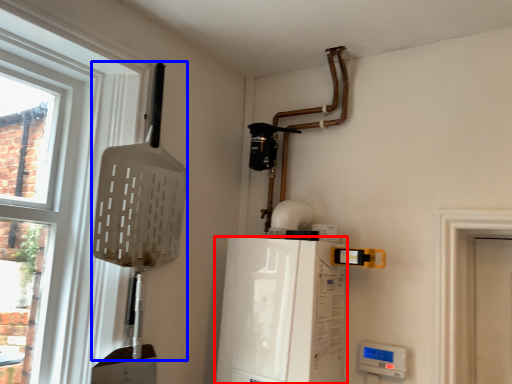
Question: Which object appears farthest to the camera in this image, appliance (highlighted by a red box) or shovel (highlighted by a blue box)?

Choices:
 (A) appliance
 (B) shovel

Answer: (A)